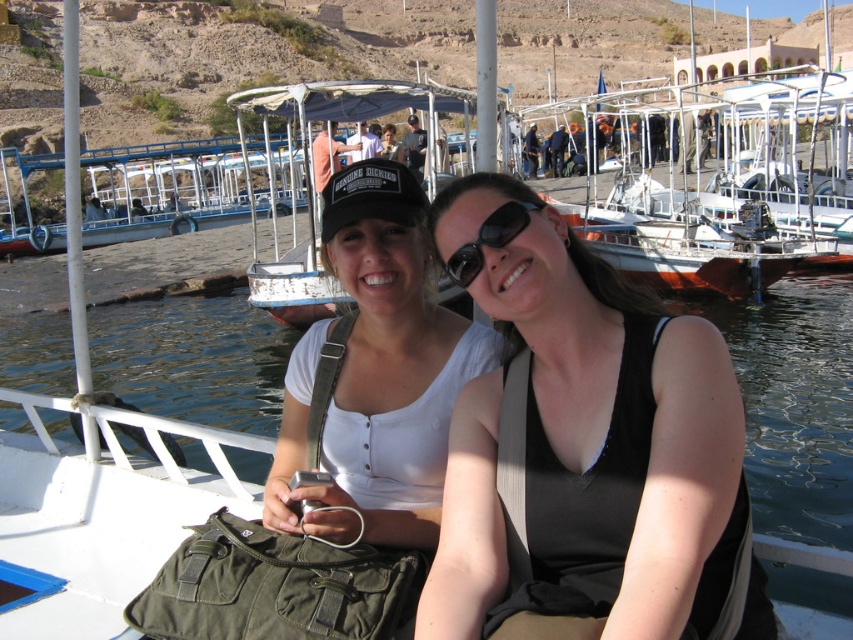
Is white wooden boat at center to the right of black reflective sunglasses at center from the viewer's perspective?

In fact, white wooden boat at center is to the left of black reflective sunglasses at center.

Does point (286, 301) come behind point (525, 204)?

Yes, point (286, 301) is farther from viewer.

What do you see at coordinates (363, 106) in the screenshot? I see `white wooden boat at center` at bounding box center [363, 106].

The width and height of the screenshot is (853, 640). Find the location of `white wooden boat at center`. white wooden boat at center is located at coordinates (363, 106).

Between point (712, 413) and point (459, 106), which one is positioned in front?

Point (712, 413) is in front.

Is point (450, 264) closer to viewer compared to point (431, 115)?

Yes.

Locate an element on the screen. The image size is (853, 640). black fabric tank top at center is located at coordinates (585, 449).

Consider the image. Who is taller, black fabric tank top at center or matte black cap at upper center?

With more height is matte black cap at upper center.

Is point (709, 378) positioned after point (387, 128)?

No, (709, 378) is closer to viewer.

Which is behind, point (686, 332) or point (387, 124)?

Positioned behind is point (387, 124).

Find the location of a particular element. This screenshot has height=640, width=853. black fabric tank top at center is located at coordinates (585, 449).